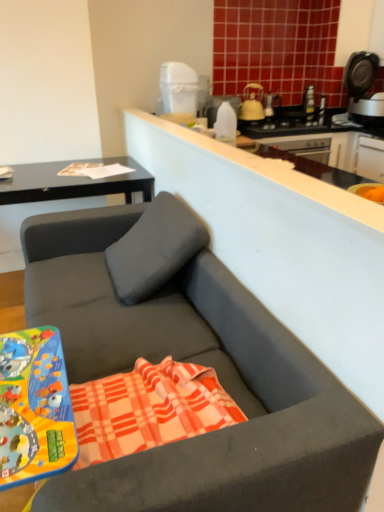
At what (x,y) coordinates should I click in order to perform the action: click on free spot above metallic plastic game board at lower left (from a real-world perspective). Please return your answer as a coordinate pair (x, y). Looking at the image, I should click on (23, 380).